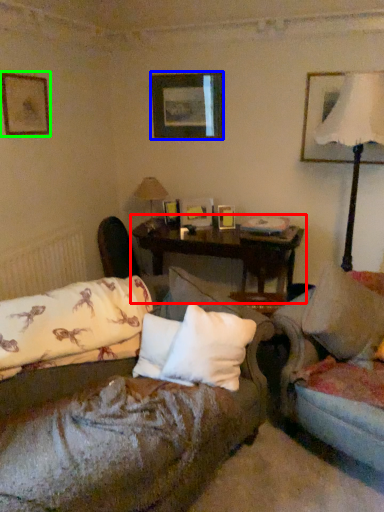
Question: Estimate the real-world distances between objects in this image. Which object is closer to table (highlighted by a red box), picture frame (highlighted by a blue box) or picture frame (highlighted by a green box)?

Choices:
 (A) picture frame
 (B) picture frame

Answer: (A)